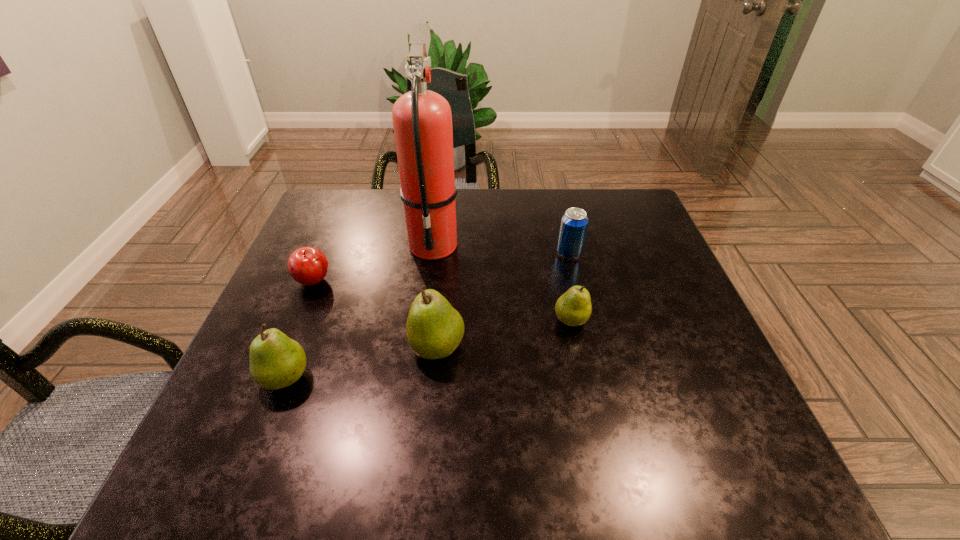
Locate an element on the screen. free space that satisfies the following two spatial constraints: 1. on the hose direction of the tallest object; 2. on the left side of the rightmost pear is located at coordinates (423, 320).